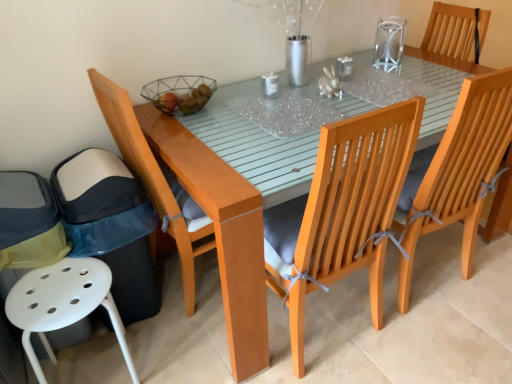
The height and width of the screenshot is (384, 512). In order to click on unoccupied area in front of clear glass vase at upper right in this screenshot , I will do `click(402, 69)`.